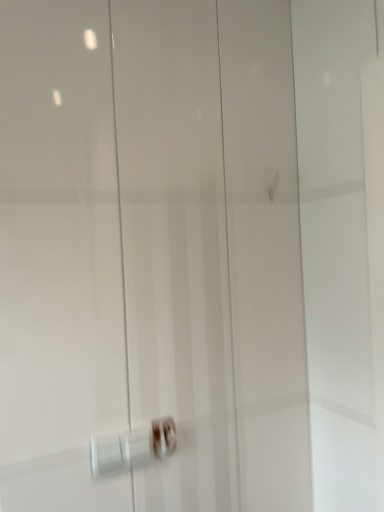
This screenshot has height=512, width=384. What do you see at coordinates (133, 446) in the screenshot? I see `white plastic door handle at lower center` at bounding box center [133, 446].

From the picture: In order to face white plastic door handle at lower center, should I rotate leftwards or rightwards?

You should rotate left by 9.049 degrees.

In order to click on white plastic door handle at lower center in this screenshot , I will do `click(133, 446)`.

The width and height of the screenshot is (384, 512). I want to click on white plastic door handle at lower center, so click(133, 446).